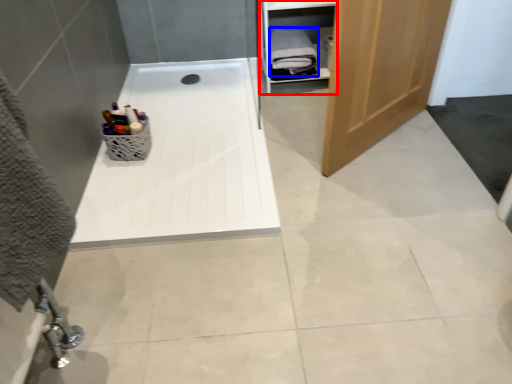
Question: Among these objects, which one is nearest to the camera, cabinet (highlighted by a red box) or bath towel (highlighted by a blue box)?

Choices:
 (A) cabinet
 (B) bath towel

Answer: (A)